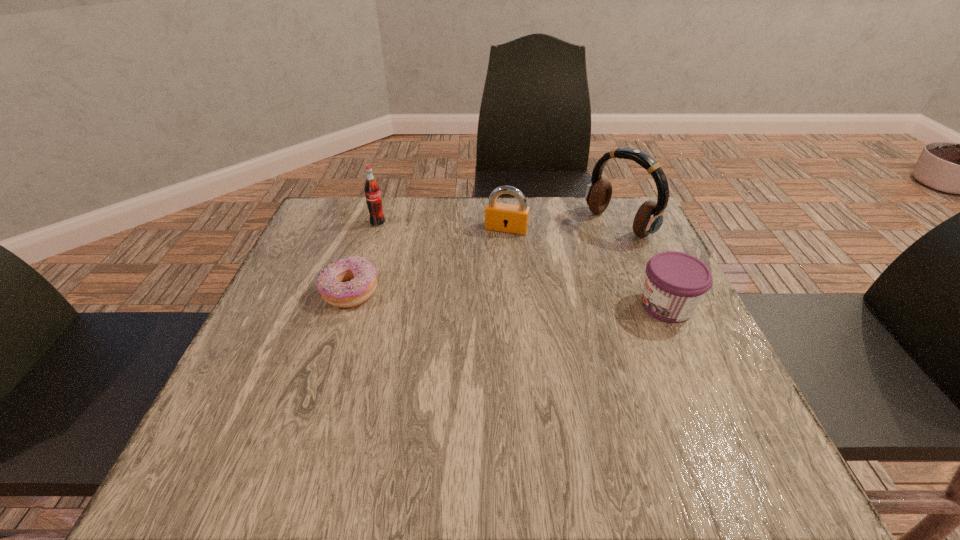
Image resolution: width=960 pixels, height=540 pixels. I want to click on free space that is in between the jam and the headset, so click(642, 265).

Identify which object is located as the fourth nearest to the soda bottle. Please provide its 2D coordinates. Your answer should be formatted as a tuple, i.e. [(x, y)], where the tuple contains the x and y coordinates of a point satisfying the conditions above.

[(675, 282)]

You are a GUI agent. You are given a task and a screenshot of the screen. Output one action in this format:
    pyautogui.click(x=<x>, y=<y>)
    Task: Click on the object identified as the fourth closest to the tallest object
    This screenshot has height=540, width=960.
    Given the screenshot: What is the action you would take?
    [372, 190]